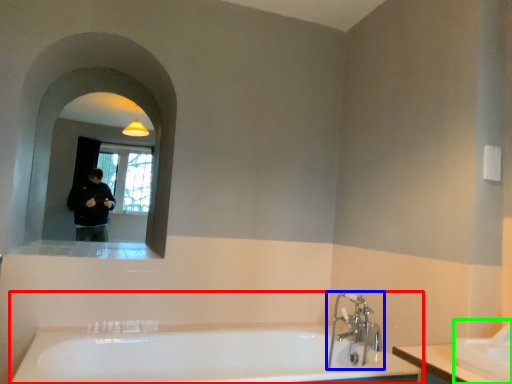
Question: Considering the real-world distances, which object is closest to bathtub (highlighted by a red box)? tap (highlighted by a blue box) or sink (highlighted by a green box).

Choices:
 (A) tap
 (B) sink

Answer: (A)